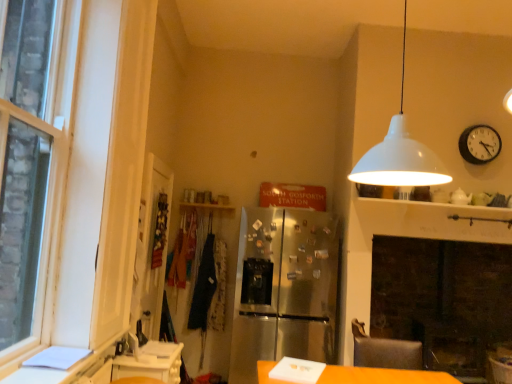
Question: Is dark blue fabric at center inside leather-like swivel chair at lower right?

Choices:
 (A) no
 (B) yes

Answer: (A)

Question: Does leather-like swivel chair at lower right have a greater height compared to dark blue fabric at center?

Choices:
 (A) yes
 (B) no

Answer: (B)

Question: Does leather-like swivel chair at lower right come behind dark blue fabric at center?

Choices:
 (A) no
 (B) yes

Answer: (A)

Question: Is leather-like swivel chair at lower right outside dark blue fabric at center?

Choices:
 (A) no
 (B) yes

Answer: (B)

Question: Does leather-like swivel chair at lower right appear on the left side of dark blue fabric at center?

Choices:
 (A) yes
 (B) no

Answer: (B)

Question: Looking at the image, does white glossy counter at lower left seem bigger or smaller compared to leather-like swivel chair at lower right?

Choices:
 (A) big
 (B) small

Answer: (B)

Question: Is point (138, 365) positioned closer to the camera than point (393, 354)?

Choices:
 (A) farther
 (B) closer

Answer: (A)

Question: Would you say white glossy counter at lower left is to the left or to the right of leather-like swivel chair at lower right in the picture?

Choices:
 (A) left
 (B) right

Answer: (A)

Question: From a real-world perspective, is white glossy counter at lower left above or below leather-like swivel chair at lower right?

Choices:
 (A) below
 (B) above

Answer: (A)

Question: Is clear glass door at left wider or thinner than stainless steel refrigerator at center?

Choices:
 (A) thin
 (B) wide

Answer: (A)

Question: In terms of size, does clear glass door at left appear bigger or smaller than stainless steel refrigerator at center?

Choices:
 (A) small
 (B) big

Answer: (A)

Question: From their relative heights in the image, would you say clear glass door at left is taller or shorter than stainless steel refrigerator at center?

Choices:
 (A) tall
 (B) short

Answer: (B)

Question: Is clear glass door at left to the left or to the right of stainless steel refrigerator at center in the image?

Choices:
 (A) left
 (B) right

Answer: (A)

Question: Considering the positions of black matte clock at upper right and stainless steel refrigerator at center in the image, is black matte clock at upper right wider or thinner than stainless steel refrigerator at center?

Choices:
 (A) wide
 (B) thin

Answer: (B)

Question: Considering the positions of black matte clock at upper right and stainless steel refrigerator at center in the image, is black matte clock at upper right taller or shorter than stainless steel refrigerator at center?

Choices:
 (A) tall
 (B) short

Answer: (B)